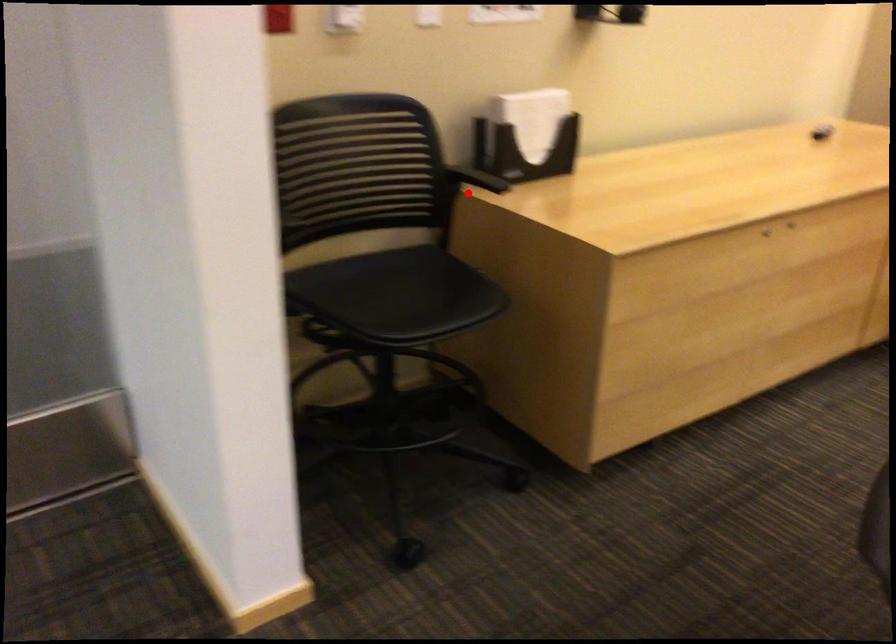
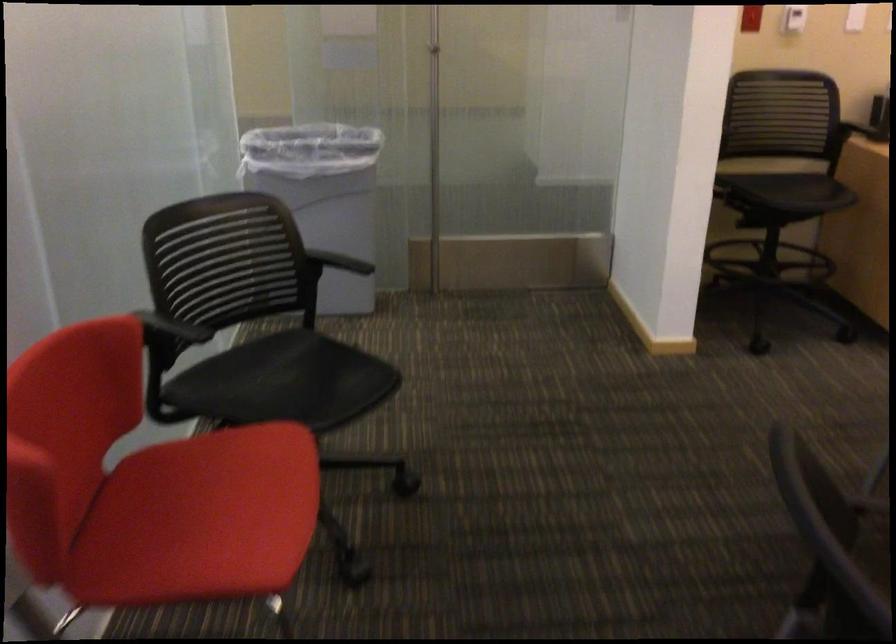
The point at the highlighted location is marked in the first image. Where is the corresponding point in the second image?

(858, 131)